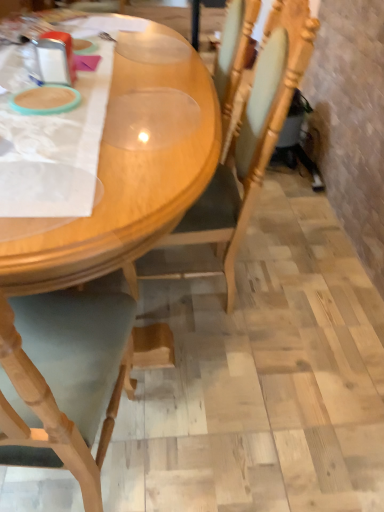
Question: Does point (220, 207) appear closer or farther from the camera than point (87, 487)?

Choices:
 (A) closer
 (B) farther

Answer: (B)

Question: From a real-world perspective, is wooden chair at center physically located above or below wooden table at center?

Choices:
 (A) below
 (B) above

Answer: (B)

Question: Is wooden chair at center bigger or smaller than wooden table at center?

Choices:
 (A) small
 (B) big

Answer: (A)

Question: Is point (54, 267) closer or farther from the camera than point (288, 27)?

Choices:
 (A) closer
 (B) farther

Answer: (A)

Question: In terms of height, does wooden table at center look taller or shorter compared to wooden chair at center?

Choices:
 (A) short
 (B) tall

Answer: (A)

Question: In the image, is wooden table at center on the left side or the right side of wooden chair at center?

Choices:
 (A) right
 (B) left

Answer: (B)

Question: From the image's perspective, is wooden table at center located above or below wooden chair at center?

Choices:
 (A) below
 (B) above

Answer: (B)